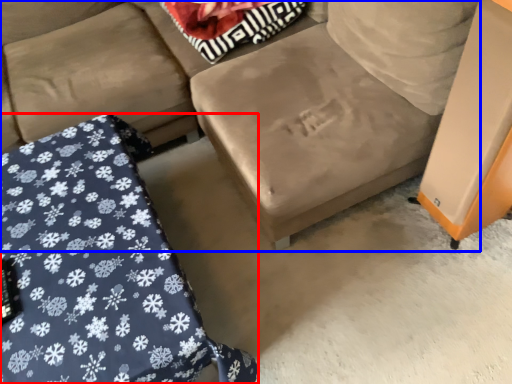
Question: Which object is closer to the camera taking this photo, furniture (highlighted by a red box) or studio couch (highlighted by a blue box)?

Choices:
 (A) furniture
 (B) studio couch

Answer: (A)